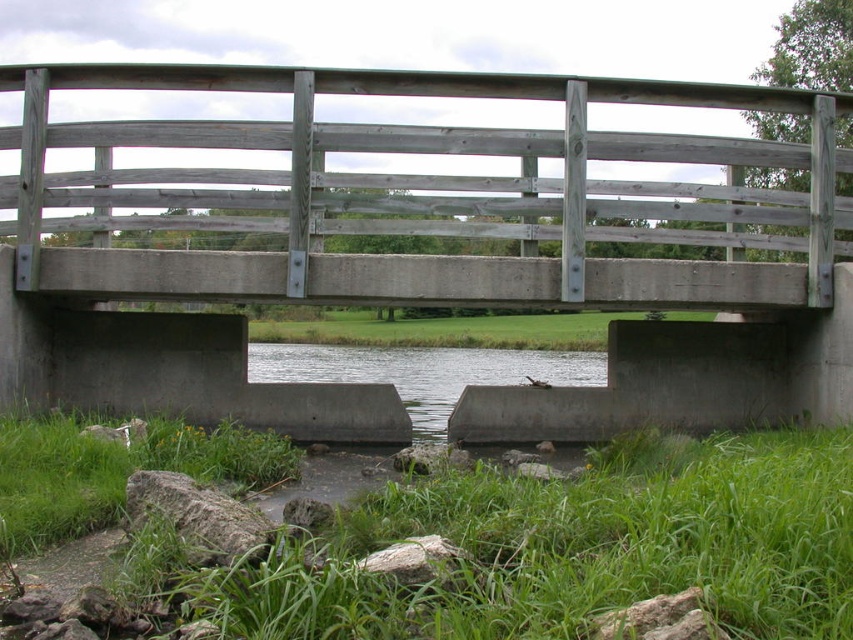
Question: Which point is closer to the camera taking this photo?

Choices:
 (A) (506, 342)
 (B) (685, 156)

Answer: (B)

Question: Among these objects, which one is farthest from the camera?

Choices:
 (A) green grass at center
 (B) gray concrete stream at center
 (C) green grass at lower left

Answer: (B)

Question: Where is gray wooden bridge at center located in relation to green grass at center in the image?

Choices:
 (A) right
 (B) left

Answer: (A)

Question: Among these points, which one is nearest to the camera?

Choices:
 (A) (811, 499)
 (B) (434, 417)
 (C) (602, 348)
 (D) (425, 86)

Answer: (A)

Question: Observing the image, what is the correct spatial positioning of gray wooden bridge at center in reference to gray concrete stream at center?

Choices:
 (A) left
 (B) right

Answer: (B)

Question: Can you confirm if gray wooden bridge at center is wider than gray concrete stream at center?

Choices:
 (A) yes
 (B) no

Answer: (B)